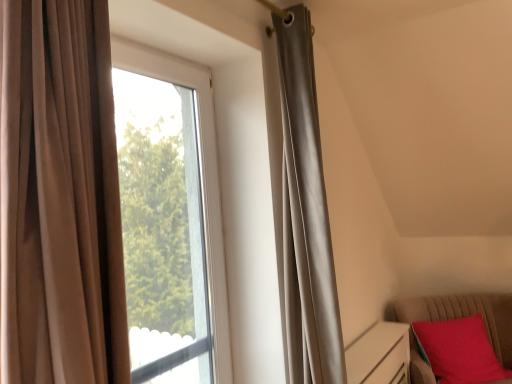
Question: Is velvet red cushion at lower right at the left side of transparent glass window at center?

Choices:
 (A) yes
 (B) no

Answer: (B)

Question: Is there a large distance between velvet red cushion at lower right and transparent glass window at center?

Choices:
 (A) no
 (B) yes

Answer: (B)

Question: From a real-world perspective, is velvet red cushion at lower right physically below transparent glass window at center?

Choices:
 (A) yes
 (B) no

Answer: (A)

Question: From the image's perspective, is velvet red cushion at lower right located beneath transparent glass window at center?

Choices:
 (A) no
 (B) yes

Answer: (B)

Question: From the image's perspective, is velvet red cushion at lower right on transparent glass window at center?

Choices:
 (A) no
 (B) yes

Answer: (A)

Question: Is the depth of velvet red cushion at lower right less than that of transparent glass window at center?

Choices:
 (A) no
 (B) yes

Answer: (A)

Question: From a real-world perspective, is transparent glass window at center positioned under velvet red cushion at lower right based on gravity?

Choices:
 (A) yes
 (B) no

Answer: (B)

Question: Considering the relative positions of transparent glass window at center and velvet red cushion at lower right in the image provided, is transparent glass window at center to the right of velvet red cushion at lower right from the viewer's perspective?

Choices:
 (A) yes
 (B) no

Answer: (B)

Question: Considering the relative positions of transparent glass window at center and velvet red cushion at lower right in the image provided, is transparent glass window at center in front of velvet red cushion at lower right?

Choices:
 (A) yes
 (B) no

Answer: (A)

Question: Is transparent glass window at center with velvet red cushion at lower right?

Choices:
 (A) no
 (B) yes

Answer: (A)

Question: Considering the relative sizes of transparent glass window at center and velvet red cushion at lower right in the image provided, is transparent glass window at center thinner than velvet red cushion at lower right?

Choices:
 (A) no
 (B) yes

Answer: (B)

Question: Could velvet red cushion at lower right be considered to be inside transparent glass window at center?

Choices:
 (A) no
 (B) yes

Answer: (A)

Question: Considering the positions of velvet red cushion at lower right and transparent glass window at center in the image, is velvet red cushion at lower right taller or shorter than transparent glass window at center?

Choices:
 (A) tall
 (B) short

Answer: (B)